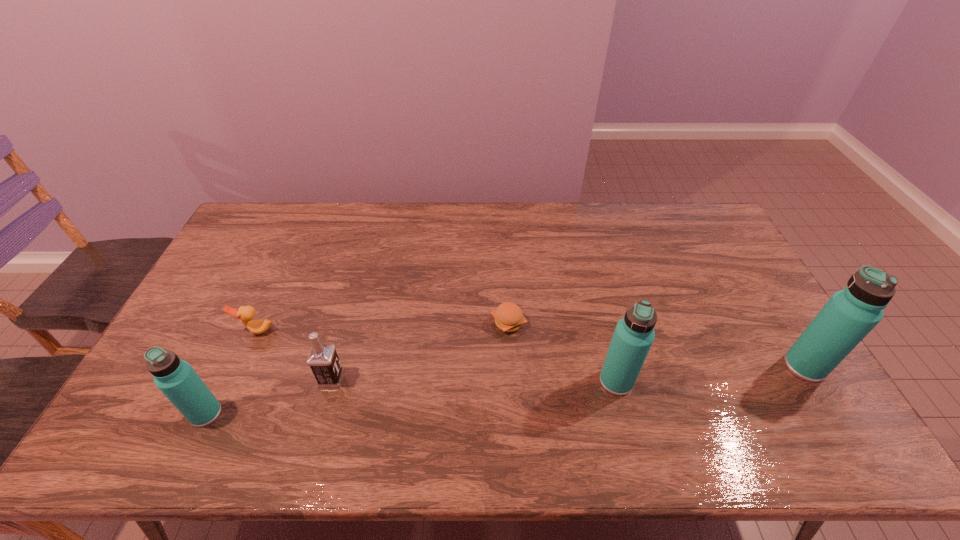
You are a GUI agent. You are given a task and a screenshot of the screen. Output one action in this format:
    pyautogui.click(x=<x>, y=<y>)
    Task: Click on the free spot that satisfies the following two spatial constraints: 1. on the front label of the fourth tallest object; 2. on the back side of the second object from right to left
    This screenshot has width=960, height=540.
    Given the screenshot: What is the action you would take?
    click(330, 381)

You are a GUI agent. You are given a task and a screenshot of the screen. Output one action in this format:
    pyautogui.click(x=<x>, y=<y>)
    Task: Click on the vacant position in the image that satisfies the following two spatial constraints: 1. on the front label of the vodka; 2. on the back side of the second thermos bottle from left to right
    
    Given the screenshot: What is the action you would take?
    (x=330, y=381)

The image size is (960, 540). In order to click on vacant area that satisfies the following two spatial constraints: 1. on the back side of the second tallest object; 2. on the right side of the rightmost object in this screenshot , I will do `click(612, 366)`.